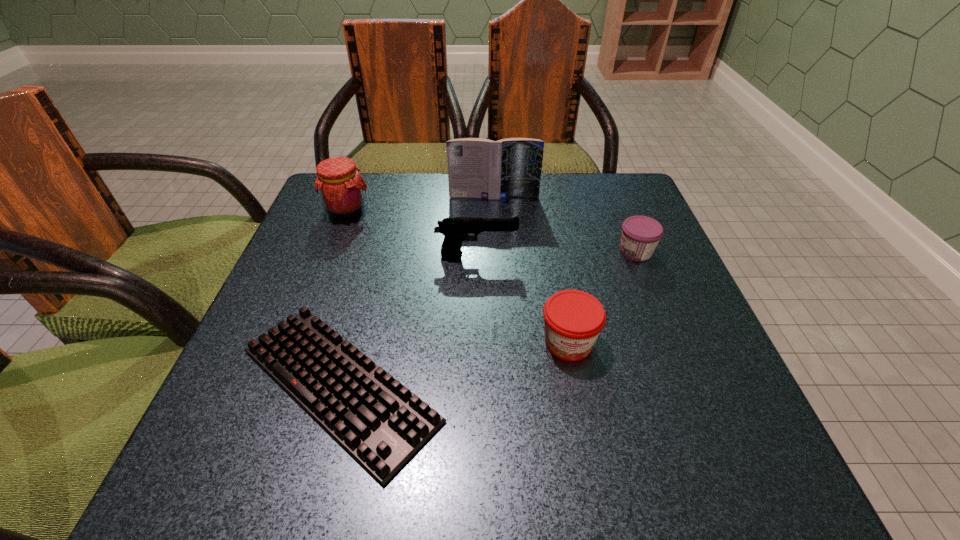
Identify the location of jam present at the left edge. (341, 188).

Identify the location of computer keyboard at the left edge. The height and width of the screenshot is (540, 960). (381, 423).

The image size is (960, 540). In order to click on object that is at the right edge in this screenshot , I will do `click(640, 236)`.

Find the location of a particular element. Image resolution: width=960 pixels, height=540 pixels. object positioned at the far left corner is located at coordinates (341, 188).

This screenshot has height=540, width=960. I want to click on object situated at the near left corner, so [381, 423].

In the image, there is a desktop. In order to click on blank space at the far edge in this screenshot , I will do `click(455, 199)`.

Where is `free region at the near edge of the desktop`? The width and height of the screenshot is (960, 540). free region at the near edge of the desktop is located at coordinates (460, 471).

The width and height of the screenshot is (960, 540). I want to click on vacant region at the left edge, so click(356, 282).

In the image, there is a desktop. Where is `vacant space at the right edge`? vacant space at the right edge is located at coordinates (644, 343).

At what (x,y) coordinates should I click in order to perform the action: click on vacant space at the far left corner. Please return your answer as a coordinate pair (x, y). This screenshot has height=540, width=960. Looking at the image, I should click on (384, 186).